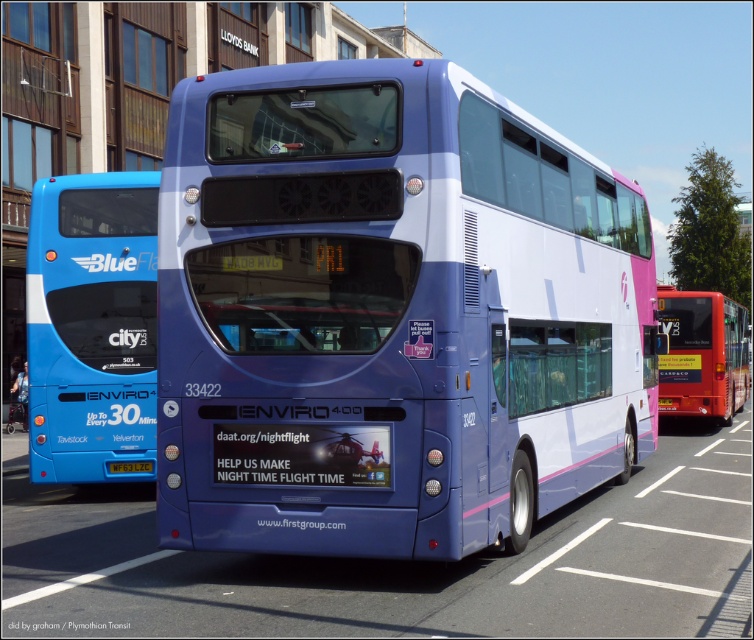
Can you confirm if blue glossy bus at left is positioned below yellow plastic license plate at center?

No, blue glossy bus at left is not below yellow plastic license plate at center.

Can you confirm if blue glossy bus at left is smaller than yellow plastic license plate at center?

Incorrect, blue glossy bus at left is not smaller in size than yellow plastic license plate at center.

Find the location of `blue glossy bus at left`. blue glossy bus at left is located at coordinates (90, 324).

Who is more distant from viewer, (x=87, y=284) or (x=700, y=360)?

Point (x=700, y=360)

Is the position of blue glossy bus at left more distant than that of red matte bus at right?

That is False.

Locate an element on the screen. Image resolution: width=754 pixels, height=640 pixels. blue glossy bus at left is located at coordinates (90, 324).

Identify the location of red matte bus at right. (702, 355).

From the picture: Who is more forward, (700, 326) or (115, 465)?

Point (115, 465)

Find the location of `red matte bus at right`. red matte bus at right is located at coordinates (702, 355).